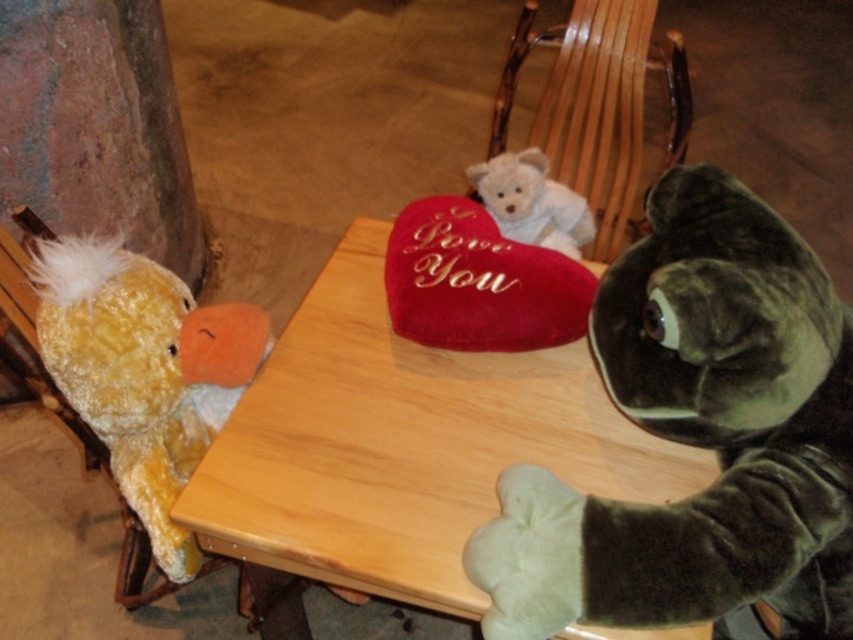
Is velvet green plush toy at right below wooden rocking chair at center?

Yes.

Is velvet green plush toy at right to the right of wooden rocking chair at center from the viewer's perspective?

Incorrect, velvet green plush toy at right is not on the right side of wooden rocking chair at center.

Is point (556, 496) positioned before point (566, 33)?

Yes, point (556, 496) is in front of point (566, 33).

Where is `velvet green plush toy at right`? The image size is (853, 640). velvet green plush toy at right is located at coordinates (699, 440).

Consider the image. Who is more distant from viewer, (181,388) or (596,157)?

The point (596,157) is behind.

Who is more forward, [258,310] or [625,161]?

Point [258,310] is more forward.

Identify the location of fuzzy yellow duck at left. Image resolution: width=853 pixels, height=640 pixels. (142, 371).

Is point (322, 538) farther from camera compared to point (544, 198)?

That is False.

Is point (258, 522) positioned before point (473, 172)?

Yes, point (258, 522) is closer to viewer.

Identify the location of wooden table at center. (404, 444).